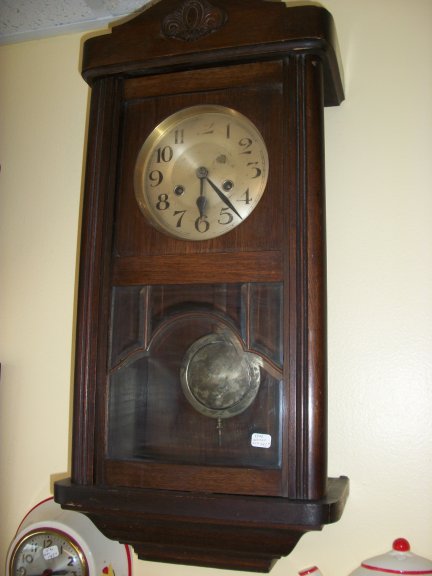
This screenshot has width=432, height=576. Identify the location of tea pot top. (406, 545).